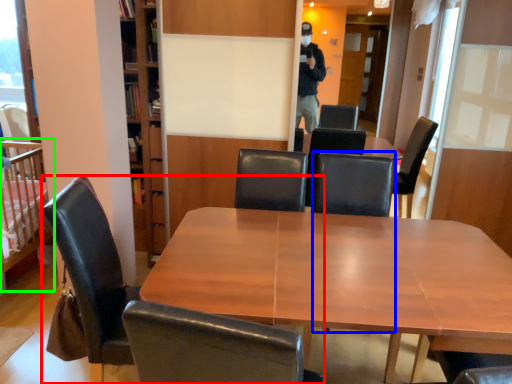
Question: Considering the real-world distances, which object is closest to chair (highlighted by a red box)? armchair (highlighted by a blue box) or infant bed (highlighted by a green box).

Choices:
 (A) armchair
 (B) infant bed

Answer: (B)